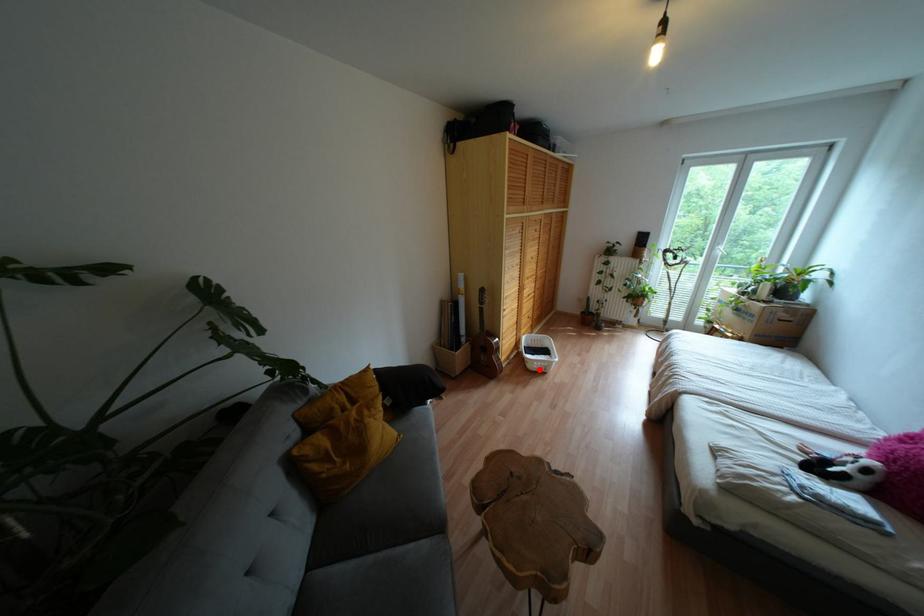
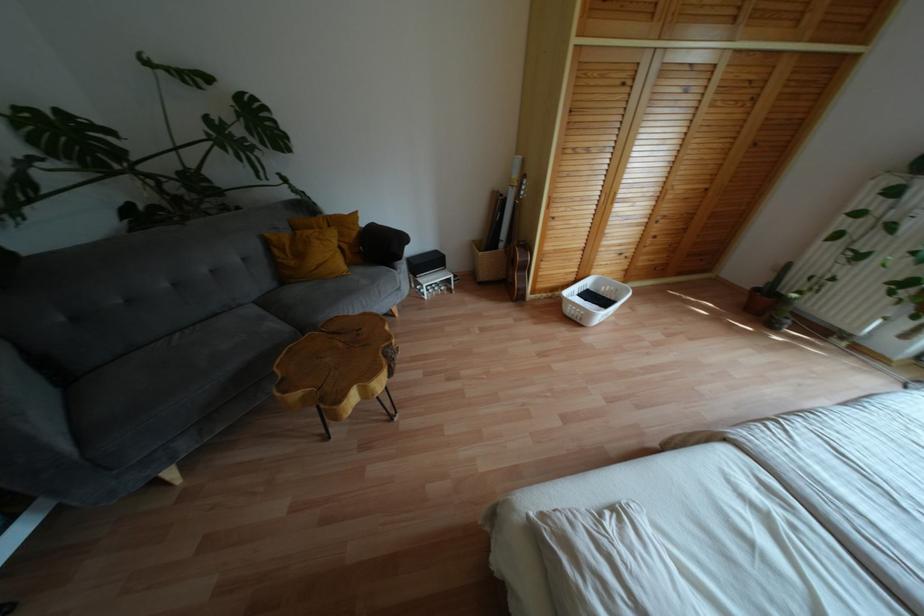
Question: I am providing you with two images of the same scene from different viewpoints. Image1 has a red point marked. In image2, the corresponding 3D location appears at what relative position? Reply with the corresponding letter.

Choices:
 (A) Closer
 (B) Farther

Answer: (A)